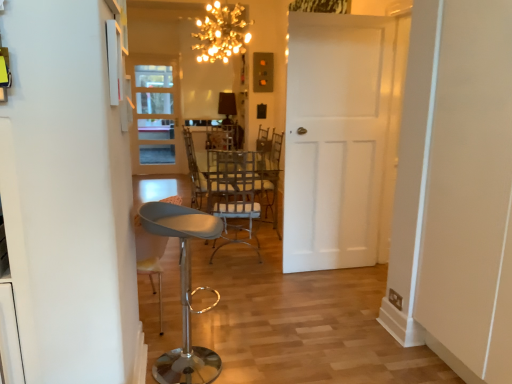
What do you see at coordinates (222, 33) in the screenshot?
I see `gold metallic chandelier at upper center` at bounding box center [222, 33].

What do you see at coordinates (234, 204) in the screenshot? I see `metallic silver chair at center` at bounding box center [234, 204].

Measure the distance between point (195, 167) and camera.

Point (195, 167) and camera are 14.67 feet apart.

The width and height of the screenshot is (512, 384). Find the location of `white glass door at left, which is the 2th door from right to left`. white glass door at left, which is the 2th door from right to left is located at coordinates (156, 115).

From the picture: Is metallic gray stool at lower left at the back of gold metallic chandelier at upper center?

That's not correct — gold metallic chandelier at upper center is not looking away from metallic gray stool at lower left.

Are gold metallic chandelier at upper center and metallic gray stool at lower left located far from each other?

That's right, there is a large distance between gold metallic chandelier at upper center and metallic gray stool at lower left.

Who is shorter, gold metallic chandelier at upper center or metallic gray stool at lower left?

Standing shorter between the two is gold metallic chandelier at upper center.

Which is closer to the camera, (242, 49) or (153, 232)?

Point (153, 232)

Which object is closer to the camera, metallic silver chair at center or white glass door at left, which is counted as the 2th door, starting from the front?

metallic silver chair at center is closer to the camera.

Is metallic silver chair at center oriented towards white glass door at left, arranged as the 1th door when viewed from the left?

No, metallic silver chair at center is not facing towards white glass door at left, arranged as the 1th door when viewed from the left.

Which is behind, point (217, 214) or point (142, 168)?

Point (142, 168)

This screenshot has width=512, height=384. I want to click on door on the left of metallic silver chair at center, so click(x=156, y=115).

Would you consider metallic gray stool at lower left to be distant from gold metallic chandelier at upper center?

Yes, metallic gray stool at lower left and gold metallic chandelier at upper center are located far from each other.

Which of these two, metallic gray stool at lower left or gold metallic chandelier at upper center, stands taller?

With more height is metallic gray stool at lower left.

What's the angular difference between metallic gray stool at lower left and gold metallic chandelier at upper center's facing directions?

164 degrees separate the facing orientations of metallic gray stool at lower left and gold metallic chandelier at upper center.

From a real-world perspective, is metallic gray stool at lower left positioned above or below gold metallic chandelier at upper center?

metallic gray stool at lower left is below gold metallic chandelier at upper center.

From the image's perspective, does white glass door at left, which is the 2th door from right to left, appear higher than white matte door at center, acting as the second door starting from the left?

Indeed, from the image's perspective, white glass door at left, which is the 2th door from right to left, is shown above white matte door at center, acting as the second door starting from the left.

Is white glass door at left, which is counted as the 2th door, starting from the front, next to white matte door at center, the 2th door viewed from the back?

No, white glass door at left, which is counted as the 2th door, starting from the front, is not touching white matte door at center, the 2th door viewed from the back.

Which is correct: white glass door at left, which is the 2th door from right to left, is inside white matte door at center, the 2th door viewed from the back, or outside of it?

The correct answer is: outside.

Measure the distance from metallic gray stool at lower left to white glass door at left, which is counted as the 1th door, starting from the back.

They are 2.24 meters apart.

From a real-world perspective, count 2nd doors upward from the metallic gray stool at lower left and point to it. Please provide its 2D coordinates.

[(156, 115)]

Is metallic gray stool at lower left inside or outside of white glass door at left, arranged as the 1th door when viewed from the left?

The correct answer is: outside.

Could you tell me if metallic gray stool at lower left is turned towards white glass door at left, arranged as the 1th door when viewed from the left?

No, metallic gray stool at lower left is not aimed at white glass door at left, arranged as the 1th door when viewed from the left.

Which object is positioned more to the left, metallic silver chair at center or white matte door at center, which appears as the 1th door when viewed from the front?

From the viewer's perspective, metallic silver chair at center appears more on the left side.

Is metallic silver chair at center taller or shorter than white matte door at center, the 2th door viewed from the back?

metallic silver chair at center is shorter than white matte door at center, the 2th door viewed from the back.

In the scene shown: Can you tell me how much metallic silver chair at center and white matte door at center, acting as the second door starting from the left, differ in facing direction?

They differ by 104 degrees in their facing directions.

From the image's perspective, which is above, metallic silver chair at center or white matte door at center, placed as the first door when sorted from right to left?

white matte door at center, placed as the first door when sorted from right to left.

Is metallic woven chair at center to the left or to the right of gold metallic chandelier at upper center in the image?

Clearly, metallic woven chair at center is on the left of gold metallic chandelier at upper center in the image.

Which is closer, (223, 206) or (248, 32)?

Point (223, 206) is positioned farther from the camera compared to point (248, 32).

How different are the orientations of metallic woven chair at center and gold metallic chandelier at upper center in degrees?

The angular difference between metallic woven chair at center and gold metallic chandelier at upper center is 1.18 degrees.

In the scene shown: Does metallic woven chair at center have a smaller size compared to gold metallic chandelier at upper center?

No.

Where is `stool lying on the left of gold metallic chandelier at upper center`? The image size is (512, 384). stool lying on the left of gold metallic chandelier at upper center is located at coordinates (184, 290).

You are a GUI agent. You are given a task and a screenshot of the screen. Output one action in this format:
    pyautogui.click(x=<x>, y=<y>)
    Task: Click on the armchair below the white glass door at left, which is counted as the 2th door, starting from the front (from the image's perspective)
    The height and width of the screenshot is (384, 512).
    Given the screenshot: What is the action you would take?
    pyautogui.click(x=234, y=204)

Looking at this image, looking at the image, which one is located closer to metallic gray stool at lower left, metallic woven chair at center or white glass door at left, which is counted as the 2th door, starting from the front?

The object closer to metallic gray stool at lower left is metallic woven chair at center.

When comparing their distances from metallic woven chair at center, does metallic silver chair at center or white glass door at left, which is counted as the 1th door, starting from the back, seem closer?

Among the two, metallic silver chair at center is located nearer to metallic woven chair at center.

When comparing their distances from metallic silver chair at center, does white glass door at left, which is counted as the 2th door, starting from the front, or white matte door at center, which appears as the 1th door when viewed from the front, seem closer?

white glass door at left, which is counted as the 2th door, starting from the front, is positioned closer to the anchor metallic silver chair at center.

Based on their spatial positions, is gold metallic chandelier at upper center or metallic silver chair at center further from white matte door at center, acting as the second door starting from the left?

gold metallic chandelier at upper center lies further to white matte door at center, acting as the second door starting from the left, than the other object.

Based on their spatial positions, is metallic silver chair at center or white glass door at left, arranged as the 1th door when viewed from the left, closer to white matte door at center, acting as the second door starting from the left?

metallic silver chair at center is closer to white matte door at center, acting as the second door starting from the left.

Considering their positions, is gold metallic chandelier at upper center positioned further to white glass door at left, arranged as the 1th door when viewed from the left, than metallic woven chair at center?

Based on the image, gold metallic chandelier at upper center appears to be further to white glass door at left, arranged as the 1th door when viewed from the left.

When comparing their distances from metallic gray stool at lower left, does white glass door at left, which is counted as the 1th door, starting from the back, or white matte door at center, which appears as the 1th door when viewed from the front, seem closer?

white matte door at center, which appears as the 1th door when viewed from the front.

Considering their positions, is gold metallic chandelier at upper center positioned closer to white glass door at left, which is the 2th door from right to left, than metallic gray stool at lower left?

The object closer to white glass door at left, which is the 2th door from right to left, is gold metallic chandelier at upper center.

Locate an element on the screen. This screenshot has height=384, width=512. lamp between metallic gray stool at lower left and metallic woven chair at center from front to back is located at coordinates (222, 33).

Locate an element on the screen. This screenshot has height=384, width=512. armchair located between white matte door at center, the 2th door viewed from the back, and metallic woven chair at center in the depth direction is located at coordinates [234, 204].

Locate an element on the screen. door positioned between metallic gray stool at lower left and white glass door at left, which is counted as the 2th door, starting from the front, from near to far is located at coordinates (340, 138).

Identify the location of door between metallic gray stool at lower left and metallic silver chair at center along the z-axis. The width and height of the screenshot is (512, 384). (340, 138).